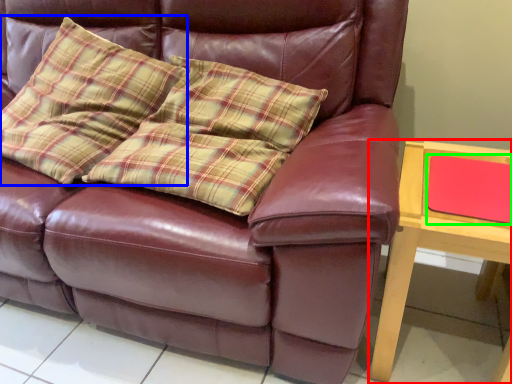
Question: Which is farther away from table (highlighted by a red box)? throw pillow (highlighted by a blue box) or pad (highlighted by a green box)?

Choices:
 (A) throw pillow
 (B) pad

Answer: (A)